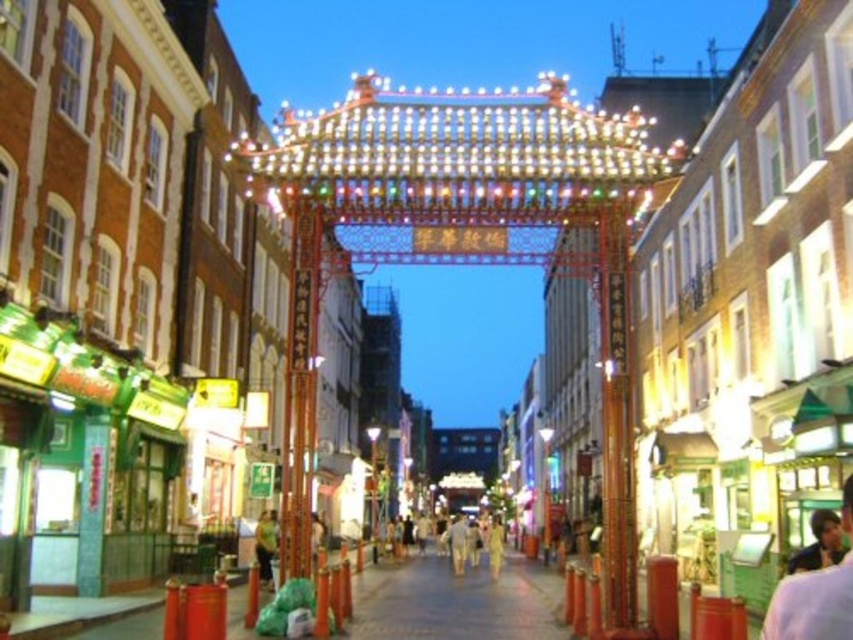
Which is below, light brown leather jacket at lower right or light beige cotton pants at center?

light beige cotton pants at center is lower down.

Looking at this image, can you confirm if light brown leather jacket at lower right is positioned below light beige cotton pants at center?

No, light brown leather jacket at lower right is not below light beige cotton pants at center.

Who is more distant from viewer, (820, 577) or (463, 538)?

The point (463, 538) is more distant.

I want to click on light brown leather jacket at lower right, so click(815, 595).

Who is taller, light beige pants at center or light beige cotton pants at center?

light beige pants at center is taller.

Is point (440, 532) less distant than point (453, 554)?

That is False.

Does point (450, 548) come closer to viewer compared to point (467, 547)?

No, (450, 548) is behind (467, 547).

The height and width of the screenshot is (640, 853). I want to click on light beige pants at center, so 461,541.

Which is above, light brown leather jacket at lower right or light beige pants at center?

light brown leather jacket at lower right is above.

Based on the photo, can you confirm if light brown leather jacket at lower right is bigger than light beige pants at center?

No, light brown leather jacket at lower right is not bigger than light beige pants at center.

Identify the location of light brown leather jacket at lower right. (815, 595).